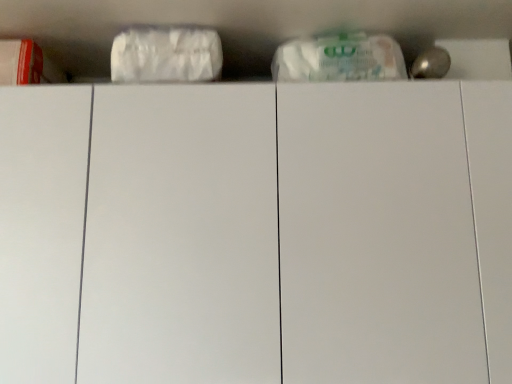
The width and height of the screenshot is (512, 384). What do you see at coordinates (166, 55) in the screenshot?
I see `white plastic bag at upper left` at bounding box center [166, 55].

The height and width of the screenshot is (384, 512). I want to click on white plastic bag at upper left, so click(x=166, y=55).

Where is `white plastic bag at upper left`? white plastic bag at upper left is located at coordinates (166, 55).